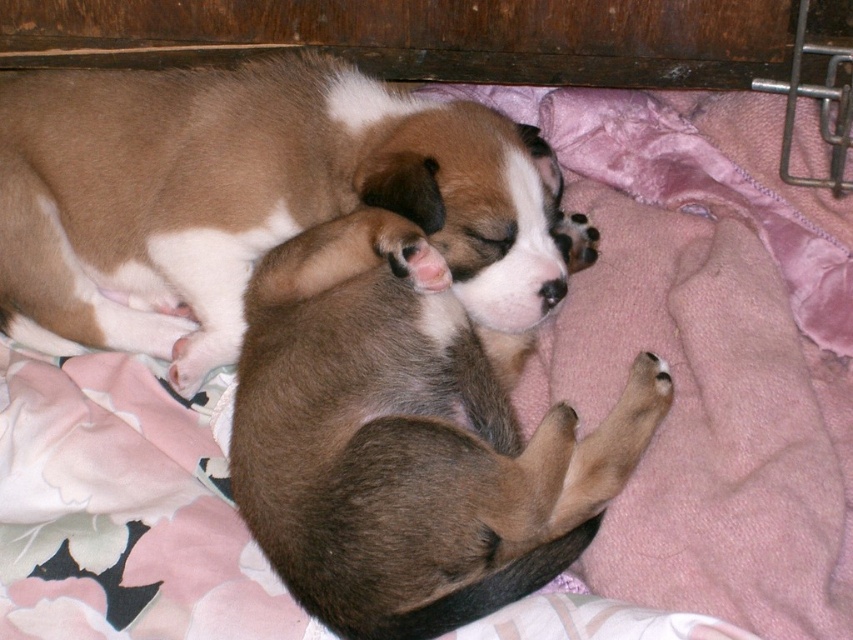
Question: Is brown fur dog at center behind brown furry dog at center?

Choices:
 (A) no
 (B) yes

Answer: (B)

Question: Can you confirm if brown fur dog at center is smaller than brown furry dog at center?

Choices:
 (A) no
 (B) yes

Answer: (B)

Question: Which point is farther from the camera taking this photo?

Choices:
 (A) (329, 344)
 (B) (553, 170)

Answer: (B)

Question: In this image, where is brown fur dog at center located relative to brown furry dog at center?

Choices:
 (A) above
 (B) below

Answer: (A)